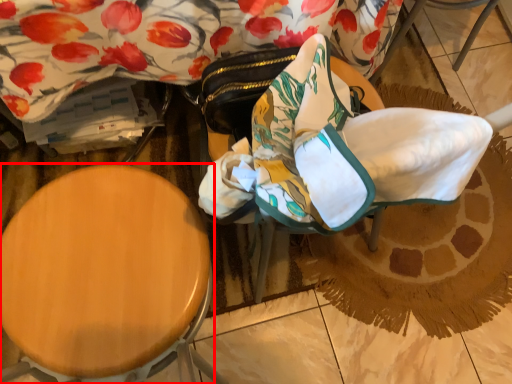
Question: From the image's perspective, considering the relative positions of furniture (annotated by the red box) and swivel chair in the image provided, where is furniture (annotated by the red box) located with respect to the staircase?

Choices:
 (A) below
 (B) above

Answer: (A)